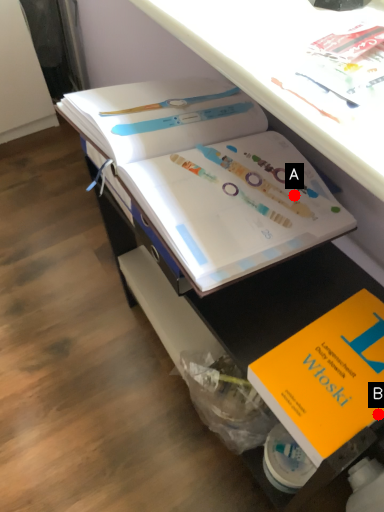
Question: Two points are circled on the image, labeled by A and B beside each circle. Which point is farther from the camera taking this photo?

Choices:
 (A) A is further
 (B) B is further

Answer: (A)